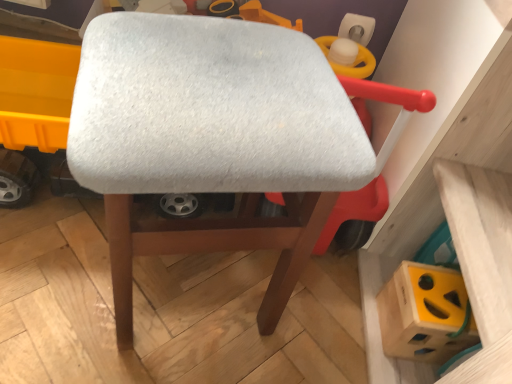
Identify the location of vacant region to the left of textured fabric chair at center. (53, 270).